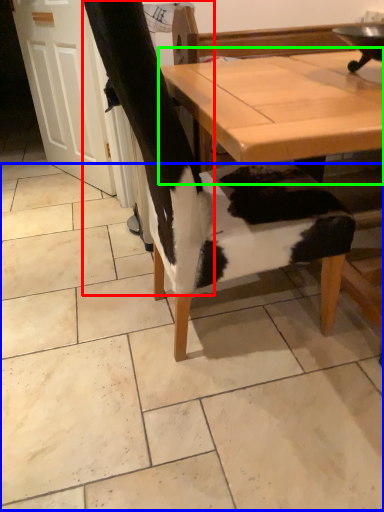
Question: Which object is positioned closest to leg (highlighted by a red box)? Select from tile (highlighted by a blue box) and table (highlighted by a green box).

Choices:
 (A) tile
 (B) table

Answer: (B)